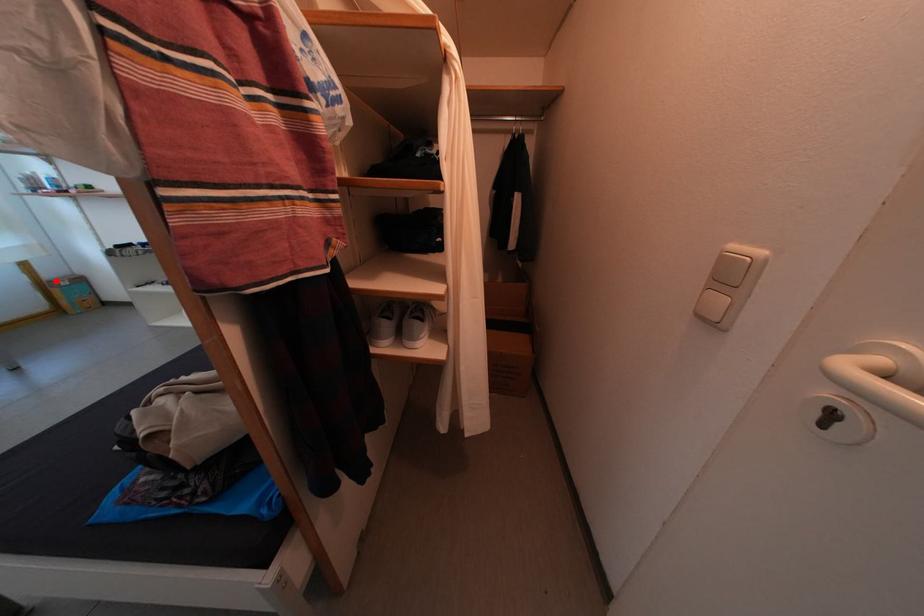
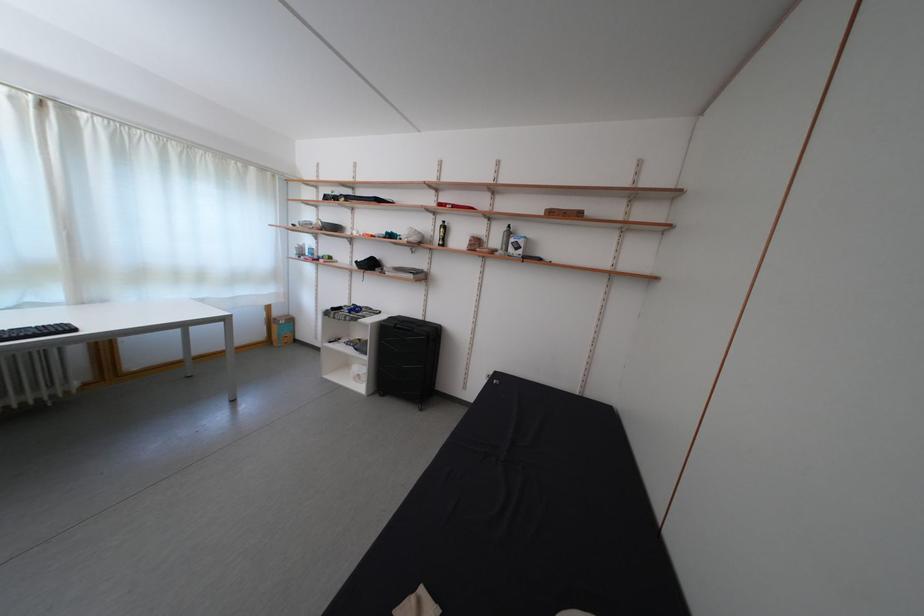
Question: I am providing you with two images of the same scene from different viewpoints. A red point is shown in image1. For the corresponding object point in image2, is it positioned nearer or farther from the camera?

Choices:
 (A) Nearer
 (B) Farther

Answer: (A)